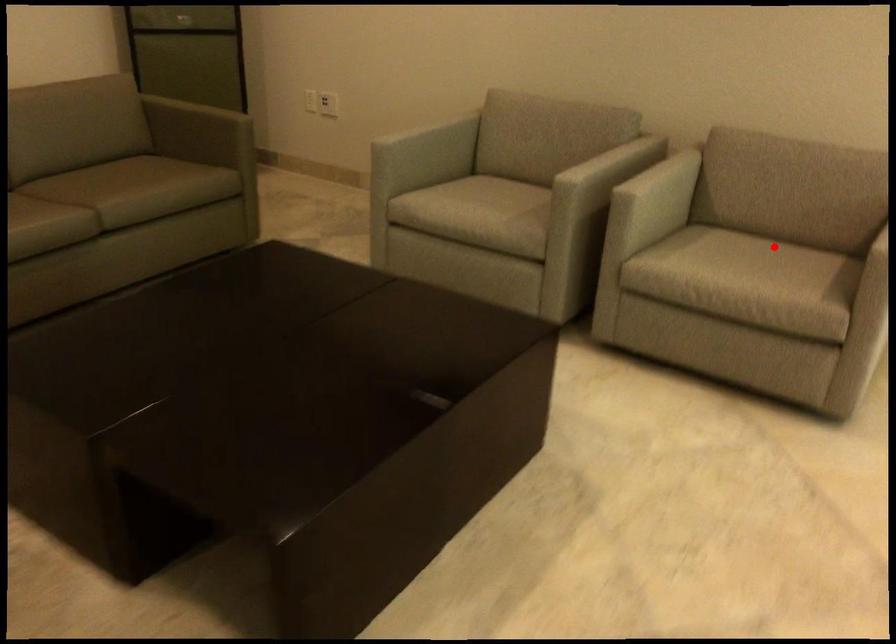
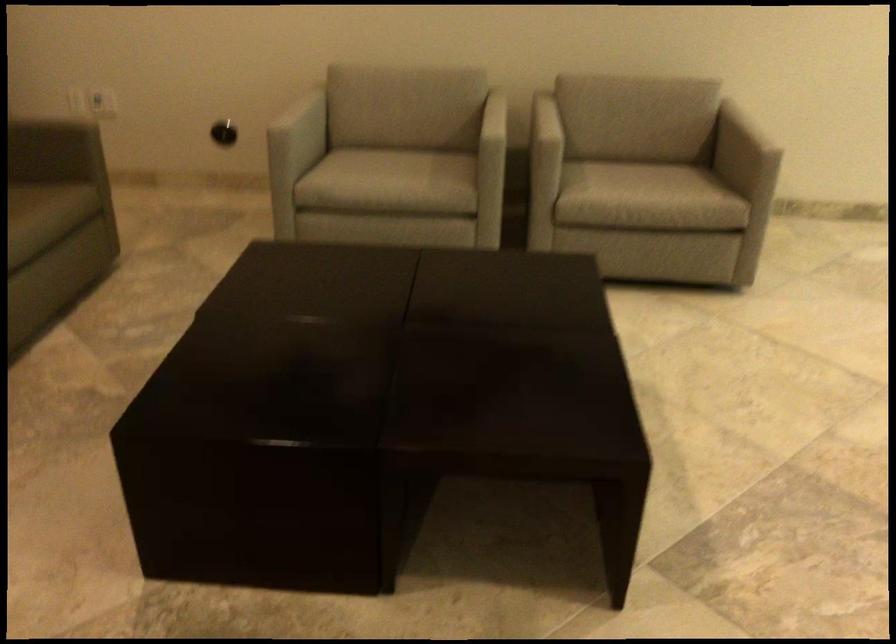
Question: I am providing you with two images of the same scene from different viewpoints. In image1, a red point is highlighted. Considering the same 3D point in image2, which of the following is correct?

Choices:
 (A) It is closer
 (B) It is farther

Answer: (B)